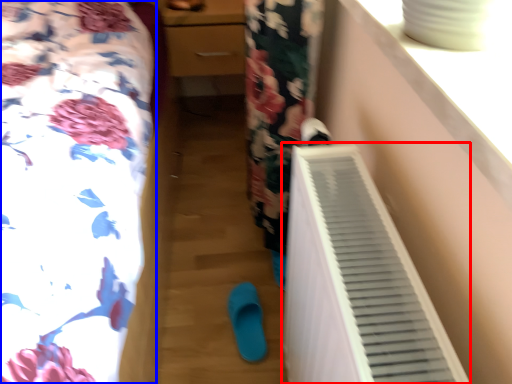
Question: Which object is further to the camera taking this photo, air conditioning (highlighted by a red box) or furniture (highlighted by a blue box)?

Choices:
 (A) air conditioning
 (B) furniture

Answer: (A)